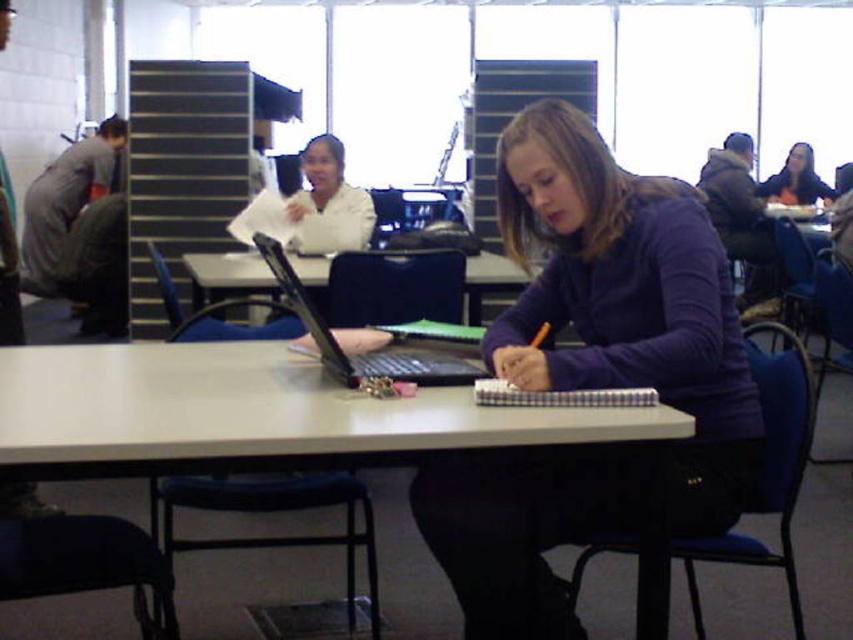
Question: Can you confirm if white matte lab coat at center is positioned to the right of matte black jacket at upper right?

Choices:
 (A) yes
 (B) no

Answer: (B)

Question: Among these points, which one is farthest from the camera?

Choices:
 (A) (405, 324)
 (B) (456, 362)
 (C) (477, 392)

Answer: (A)

Question: Can you confirm if purple matte sweater at center is smaller than white matte lab coat at center?

Choices:
 (A) no
 (B) yes

Answer: (A)

Question: Is white matte lab coat at center positioned in front of checkered paper notebook at center?

Choices:
 (A) no
 (B) yes

Answer: (A)

Question: Which of the following is the farthest from the observer?

Choices:
 (A) white plastic table at center
 (B) white matte lab coat at center

Answer: (B)

Question: Which point appears closest to the camera in this image?

Choices:
 (A) coord(273,291)
 (B) coord(616,401)
 (C) coord(805,170)

Answer: (B)